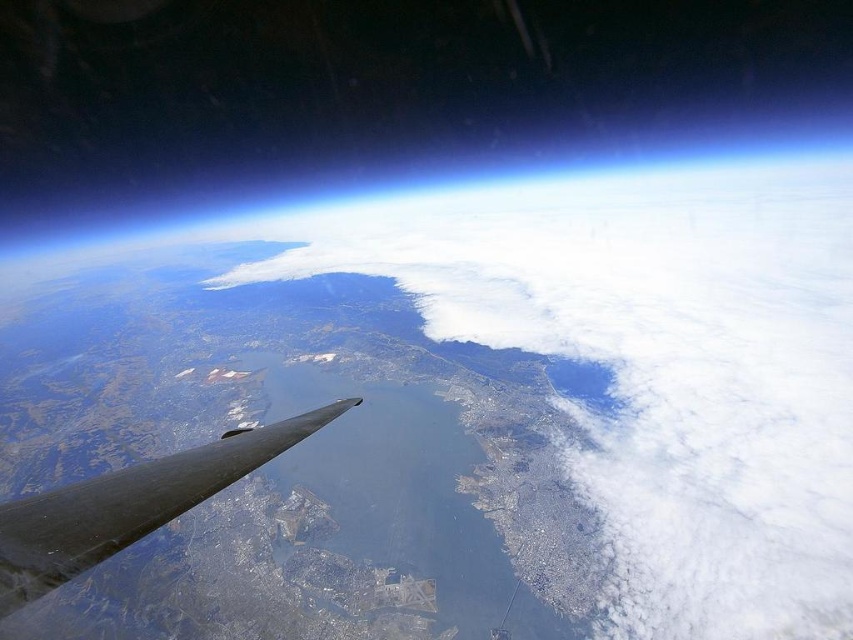
You are a pilot flying an aircraft and notice the white fluffy cloud at center and the shiny metallic wing at lower left from your current position. Which object appears bigger in your view?

The white fluffy cloud at center appears bigger than the shiny metallic wing at lower left because it has a larger size compared to the shiny metallic wing at lower left.

Based on the photo, you are a pilot flying an aircraft and need to determine the distance between two points on the ground below. The points are labeled as point 1 at coordinates point [514,196] and point 2 at coordinates point [38,561]. Considering the perspective from the aircraft, which point is closer to the aircraft?

Point [514,196] is further to the viewer than point [38,561], so point [38,561] is closer to the aircraft.